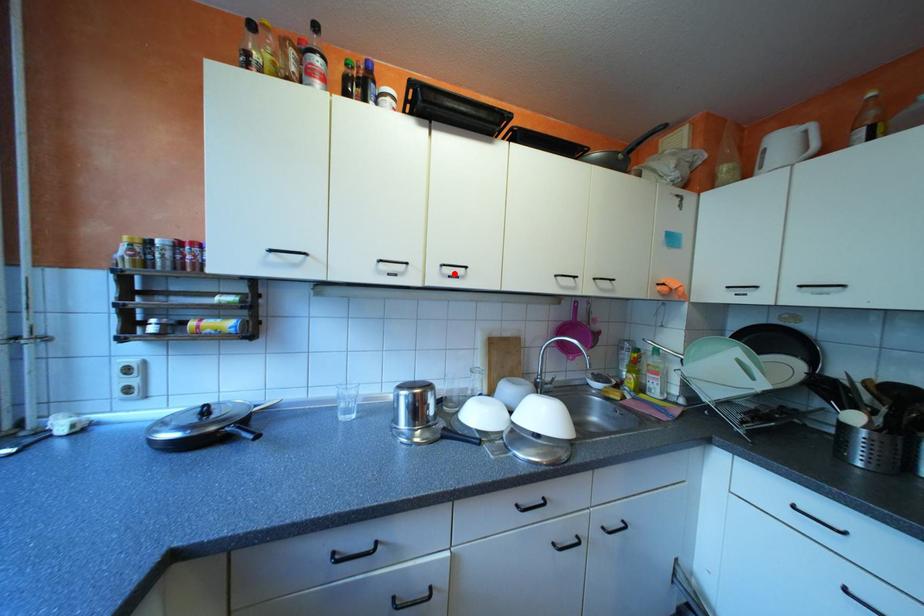
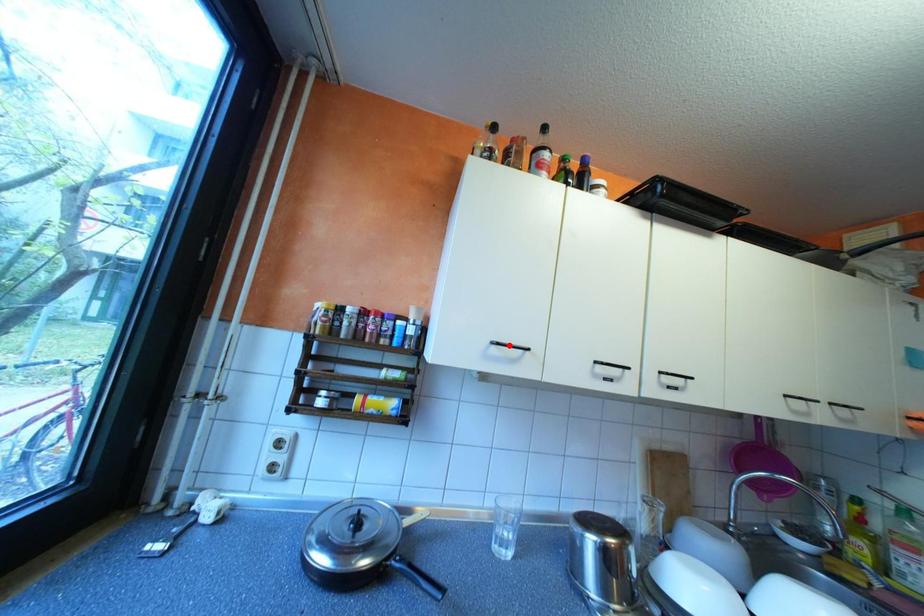
I am providing you with two images of the same scene from different viewpoints. A red point is marked on the first image and another point is marked on the second image. Is the red point in image1 aligned with the point shown in image2?

No